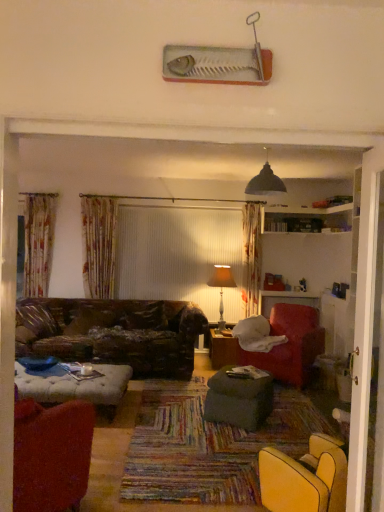
Question: Considering the relative sizes of matte beige lampshade at center and black matte lampshade at upper center in the image provided, is matte beige lampshade at center shorter than black matte lampshade at upper center?

Choices:
 (A) no
 (B) yes

Answer: (A)

Question: Is the position of matte beige lampshade at center more distant than that of black matte lampshade at upper center?

Choices:
 (A) yes
 (B) no

Answer: (A)

Question: Is matte beige lampshade at center at the right side of black matte lampshade at upper center?

Choices:
 (A) yes
 (B) no

Answer: (B)

Question: From the image's perspective, does matte beige lampshade at center appear lower than black matte lampshade at upper center?

Choices:
 (A) yes
 (B) no

Answer: (A)

Question: Is matte beige lampshade at center far away from black matte lampshade at upper center?

Choices:
 (A) yes
 (B) no

Answer: (A)

Question: In the image, is velvet red armchair at right, arranged as the first chair when viewed from the right, on the left side or the right side of wooden table at center, acting as the 1th table starting from the back?

Choices:
 (A) left
 (B) right

Answer: (B)

Question: From the image's perspective, is velvet red armchair at right, placed as the 2th chair when sorted from left to right, positioned above or below wooden table at center, acting as the 1th table starting from the back?

Choices:
 (A) above
 (B) below

Answer: (A)

Question: From a real-world perspective, is velvet red armchair at right, arranged as the first chair when viewed from the right, positioned above or below wooden table at center, acting as the second table starting from the front?

Choices:
 (A) below
 (B) above

Answer: (B)

Question: Is velvet red armchair at right, arranged as the first chair when viewed from the right, taller or shorter than wooden table at center, acting as the second table starting from the front?

Choices:
 (A) tall
 (B) short

Answer: (A)

Question: Considering the relative positions of matte beige lampshade at center and dark green fabric ottoman at center, which appears as the second table when viewed from the back, in the image provided, is matte beige lampshade at center to the left or to the right of dark green fabric ottoman at center, which appears as the second table when viewed from the back,?

Choices:
 (A) right
 (B) left

Answer: (B)

Question: Is matte beige lampshade at center wider or thinner than dark green fabric ottoman at center, which appears as the second table when viewed from the back?

Choices:
 (A) thin
 (B) wide

Answer: (A)

Question: Is matte beige lampshade at center in front of or behind dark green fabric ottoman at center, which appears as the second table when viewed from the back, in the image?

Choices:
 (A) front
 (B) behind

Answer: (B)

Question: In terms of size, does matte beige lampshade at center appear bigger or smaller than dark green fabric ottoman at center, which is counted as the first table, starting from the front?

Choices:
 (A) small
 (B) big

Answer: (B)

Question: From the image's perspective, is black matte lampshade at upper center located above or below wooden table at center, acting as the second table starting from the front?

Choices:
 (A) below
 (B) above

Answer: (B)

Question: Is black matte lampshade at upper center inside or outside of wooden table at center, acting as the second table starting from the front?

Choices:
 (A) inside
 (B) outside

Answer: (B)